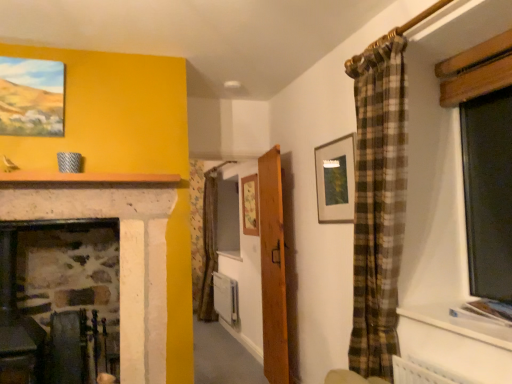
Identify the location of white stone mantle at upper center. The image size is (512, 384). (86, 178).

The image size is (512, 384). Describe the element at coordinates (86, 178) in the screenshot. I see `white stone mantle at upper center` at that location.

What is the approximate height of matte gold picture frame at upper center, which is the first picture frame from right to left?

The height of matte gold picture frame at upper center, which is the first picture frame from right to left, is 22.06 inches.

What are the coordinates of `wooden door at center` in the screenshot? It's located at pos(273,268).

Image resolution: width=512 pixels, height=384 pixels. I want to click on wooden picture frame at center, arranged as the 2th picture frame when viewed from the left, so click(x=250, y=205).

This screenshot has height=384, width=512. What do you see at coordinates (225, 297) in the screenshot?
I see `white plastic radiator at center` at bounding box center [225, 297].

I want to click on matte wooden picture frame at upper left, which is the third picture frame in right-to-left order, so click(x=31, y=97).

Is wooden door at center looking in the opposite direction of matte wooden picture frame at upper left, the third picture frame when ordered from back to front?

That's not correct — wooden door at center is not looking away from matte wooden picture frame at upper left, the third picture frame when ordered from back to front.

How much distance is there between wooden door at center and matte wooden picture frame at upper left, the 1th picture frame when ordered from front to back?

wooden door at center is 1.76 meters away from matte wooden picture frame at upper left, the 1th picture frame when ordered from front to back.

Can you confirm if wooden door at center is taller than matte wooden picture frame at upper left, which is the third picture frame in right-to-left order?

Yes.

How different are the orientations of wooden door at center and matte wooden picture frame at upper left, the third picture frame when ordered from back to front, in degrees?

99.1 degrees.

Considering the relative sizes of matte gold picture frame at upper center, the 3th picture frame when ordered from left to right, and matte wooden picture frame at upper left, the 1th picture frame when ordered from front to back, in the image provided, is matte gold picture frame at upper center, the 3th picture frame when ordered from left to right, shorter than matte wooden picture frame at upper left, the 1th picture frame when ordered from front to back,?

No.

Which object is wider, matte gold picture frame at upper center, which ranks as the second picture frame in back-to-front order, or matte wooden picture frame at upper left, the third picture frame when ordered from back to front?

matte wooden picture frame at upper left, the third picture frame when ordered from back to front.

Does point (344, 207) come farther from viewer compared to point (5, 62)?

Yes, point (344, 207) is farther from viewer.

Is the surface of matte gold picture frame at upper center, which ranks as the second picture frame in back-to-front order, in direct contact with matte wooden picture frame at upper left, which is the third picture frame in right-to-left order?

They are not placed beside each other.

Would you say white plastic radiator at center is inside or outside wooden picture frame at center, arranged as the 2th picture frame when viewed from the left?

white plastic radiator at center cannot be found inside wooden picture frame at center, arranged as the 2th picture frame when viewed from the left.

Is white plastic radiator at center oriented away from wooden picture frame at center, the 1th picture frame viewed from the back?

No, white plastic radiator at center's orientation is not away from wooden picture frame at center, the 1th picture frame viewed from the back.

Which of these two, white plastic radiator at center or wooden picture frame at center, arranged as the 2th picture frame when viewed from the left, is thinner?

wooden picture frame at center, arranged as the 2th picture frame when viewed from the left, is thinner.

Between white plastic radiator at center and wooden door at center, which one is positioned in front?

wooden door at center is in front.

Which object is positioned more to the left, white plastic radiator at center or wooden door at center?

Positioned to the left is white plastic radiator at center.

How far apart are white plastic radiator at center and wooden door at center?

A distance of 5.71 feet exists between white plastic radiator at center and wooden door at center.

Is white plastic radiator at center touching wooden door at center?

white plastic radiator at center is not next to wooden door at center, and they're not touching.

Is wooden door at center at the back of matte gold picture frame at upper center, which is the first picture frame from right to left?

matte gold picture frame at upper center, which is the first picture frame from right to left, does not have its back to wooden door at center.

Is matte gold picture frame at upper center, the 3th picture frame when ordered from left to right, situated inside wooden door at center or outside?

matte gold picture frame at upper center, the 3th picture frame when ordered from left to right, lies outside wooden door at center.

From the image's perspective, is matte gold picture frame at upper center, which is the first picture frame from right to left, beneath wooden door at center?

Actually, matte gold picture frame at upper center, which is the first picture frame from right to left, appears above wooden door at center in the image.

Which of these two, matte gold picture frame at upper center, which ranks as the 2th picture frame in front-to-back order, or wooden door at center, is wider?

wooden door at center is wider.

From the image's perspective, which is above, matte wooden picture frame at upper left, the third picture frame when ordered from back to front, or wooden picture frame at center, the 1th picture frame viewed from the back?

matte wooden picture frame at upper left, the third picture frame when ordered from back to front, is shown above in the image.

Is matte wooden picture frame at upper left, the 1th picture frame when ordered from front to back, situated inside wooden picture frame at center, which is the third picture frame in front-to-back order, or outside?

matte wooden picture frame at upper left, the 1th picture frame when ordered from front to back, is outside wooden picture frame at center, which is the third picture frame in front-to-back order.

Could you tell me if matte wooden picture frame at upper left, the third picture frame when ordered from back to front, is turned towards wooden picture frame at center, the 1th picture frame viewed from the back?

No, matte wooden picture frame at upper left, the third picture frame when ordered from back to front, is not aimed at wooden picture frame at center, the 1th picture frame viewed from the back.

Who is smaller, matte wooden picture frame at upper left, which is the third picture frame in right-to-left order, or wooden picture frame at center, the 1th picture frame viewed from the back?

matte wooden picture frame at upper left, which is the third picture frame in right-to-left order, is smaller.

Locate an element on the screen. The image size is (512, 384). radiator on the left of wooden picture frame at center, which is the second picture frame from right to left is located at coordinates (225, 297).

Could you tell me if wooden picture frame at center, arranged as the 2th picture frame when viewed from the left, is turned towards white plastic radiator at center?

No, wooden picture frame at center, arranged as the 2th picture frame when viewed from the left, does not turn towards white plastic radiator at center.

Would you say wooden picture frame at center, the 1th picture frame viewed from the back, is inside or outside white plastic radiator at center?

wooden picture frame at center, the 1th picture frame viewed from the back, is spatially situated outside white plastic radiator at center.

Which point is more distant from viewer, (253, 197) or (224, 285)?

Positioned behind is point (224, 285).

Locate an element on the screen. This screenshot has width=512, height=384. the 2nd picture frame in front when counting from the wooden door at center is located at coordinates (31, 97).

Where is `picture frame above the matte gold picture frame at upper center, the 3th picture frame when ordered from left to right (from the image's perspective)`? picture frame above the matte gold picture frame at upper center, the 3th picture frame when ordered from left to right (from the image's perspective) is located at coordinates (31, 97).

From the image, which object appears to be nearer to wooden picture frame at center, the 1th picture frame viewed from the back, matte wooden picture frame at upper left, marked as the 1th picture frame in a left-to-right arrangement, or matte gold picture frame at upper center, which ranks as the second picture frame in back-to-front order?

matte gold picture frame at upper center, which ranks as the second picture frame in back-to-front order, is closer to wooden picture frame at center, the 1th picture frame viewed from the back.

Based on the photo, which object lies further to the anchor point matte gold picture frame at upper center, which ranks as the 2th picture frame in front-to-back order, white stone mantle at upper center or wooden door at center?

The object further to matte gold picture frame at upper center, which ranks as the 2th picture frame in front-to-back order, is white stone mantle at upper center.

Considering their positions, is matte gold picture frame at upper center, the 3th picture frame when ordered from left to right, positioned further to matte wooden picture frame at upper left, which is the third picture frame in right-to-left order, than wooden picture frame at center, arranged as the 2th picture frame when viewed from the left?

wooden picture frame at center, arranged as the 2th picture frame when viewed from the left, is further to matte wooden picture frame at upper left, which is the third picture frame in right-to-left order.

Based on their spatial positions, is wooden picture frame at center, the 1th picture frame viewed from the back, or matte wooden picture frame at upper left, which is the third picture frame in right-to-left order, closer to matte gold picture frame at upper center, which ranks as the second picture frame in back-to-front order?

Based on the image, wooden picture frame at center, the 1th picture frame viewed from the back, appears to be nearer to matte gold picture frame at upper center, which ranks as the second picture frame in back-to-front order.

Estimate the real-world distances between objects in this image. Which object is further from white plastic radiator at center, white stone mantle at upper center or matte wooden picture frame at upper left, which is the third picture frame in right-to-left order?

Based on the image, matte wooden picture frame at upper left, which is the third picture frame in right-to-left order, appears to be further to white plastic radiator at center.

Considering their positions, is wooden door at center positioned further to matte gold picture frame at upper center, which ranks as the second picture frame in back-to-front order, than white stone mantle at upper center?

Among the two, white stone mantle at upper center is located further to matte gold picture frame at upper center, which ranks as the second picture frame in back-to-front order.

Looking at the image, which one is located closer to white plastic radiator at center, white stone mantle at upper center or wooden door at center?

Among the two, wooden door at center is located nearer to white plastic radiator at center.

Estimate the real-world distances between objects in this image. Which object is closer to white stone mantle at upper center, matte wooden picture frame at upper left, the 1th picture frame when ordered from front to back, or wooden door at center?

Among the two, matte wooden picture frame at upper left, the 1th picture frame when ordered from front to back, is located nearer to white stone mantle at upper center.

I want to click on picture frame positioned between matte gold picture frame at upper center, which ranks as the 2th picture frame in front-to-back order, and white plastic radiator at center from near to far, so click(x=250, y=205).

The image size is (512, 384). Find the location of `door between matte wooden picture frame at upper left, which is the third picture frame in right-to-left order, and matte gold picture frame at upper center, which ranks as the 2th picture frame in front-to-back order, in the horizontal direction`. door between matte wooden picture frame at upper left, which is the third picture frame in right-to-left order, and matte gold picture frame at upper center, which ranks as the 2th picture frame in front-to-back order, in the horizontal direction is located at coordinates (273, 268).

Identify the location of mantle between matte wooden picture frame at upper left, the third picture frame when ordered from back to front, and matte gold picture frame at upper center, which is the first picture frame from right to left. (86, 178).

What are the coordinates of `door between white stone mantle at upper center and wooden picture frame at center, which is the third picture frame in front-to-back order, along the z-axis` in the screenshot? It's located at (273, 268).